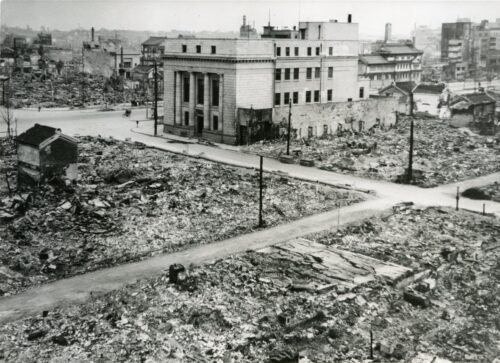
The width and height of the screenshot is (500, 363). I want to click on pillar, so click(178, 95), click(194, 86), click(207, 107), click(222, 97).